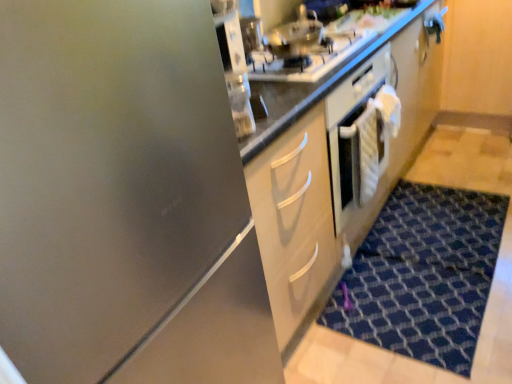
Question: Does stainless steel gas stove at upper center have a smaller size compared to stainless steel at upper center?

Choices:
 (A) yes
 (B) no

Answer: (B)

Question: From a real-world perspective, is stainless steel gas stove at upper center located beneath stainless steel at upper center?

Choices:
 (A) no
 (B) yes

Answer: (B)

Question: Is stainless steel gas stove at upper center directly adjacent to stainless steel at upper center?

Choices:
 (A) no
 (B) yes

Answer: (B)

Question: Does stainless steel gas stove at upper center have a greater width compared to stainless steel at upper center?

Choices:
 (A) no
 (B) yes

Answer: (B)

Question: Considering the relative positions of stainless steel gas stove at upper center and stainless steel at upper center in the image provided, is stainless steel gas stove at upper center to the left of stainless steel at upper center from the viewer's perspective?

Choices:
 (A) no
 (B) yes

Answer: (B)

Question: Considering the relative positions of stainless steel gas stove at upper center and stainless steel at upper center in the image provided, is stainless steel gas stove at upper center to the left or to the right of stainless steel at upper center?

Choices:
 (A) left
 (B) right

Answer: (A)

Question: Considering the positions of stainless steel gas stove at upper center and stainless steel at upper center in the image, is stainless steel gas stove at upper center taller or shorter than stainless steel at upper center?

Choices:
 (A) short
 (B) tall

Answer: (A)

Question: Does point (348, 54) appear closer or farther from the camera than point (309, 18)?

Choices:
 (A) closer
 (B) farther

Answer: (A)

Question: In terms of size, does stainless steel gas stove at upper center appear bigger or smaller than stainless steel at upper center?

Choices:
 (A) small
 (B) big

Answer: (B)

Question: In terms of height, does stainless steel at upper center look taller or shorter compared to stainless steel gas stove at upper center?

Choices:
 (A) short
 (B) tall

Answer: (B)

Question: From the image's perspective, is stainless steel at upper center above or below stainless steel gas stove at upper center?

Choices:
 (A) below
 (B) above

Answer: (B)

Question: Is stainless steel at upper center situated inside stainless steel gas stove at upper center or outside?

Choices:
 (A) inside
 (B) outside

Answer: (B)

Question: Does point (290, 51) appear closer or farther from the camera than point (349, 49)?

Choices:
 (A) closer
 (B) farther

Answer: (A)

Question: Visually, is stainless steel at upper center positioned to the left or to the right of blue textured rug at lower right?

Choices:
 (A) left
 (B) right

Answer: (A)

Question: From a real-world perspective, relative to blue textured rug at lower right, is stainless steel at upper center vertically above or below?

Choices:
 (A) below
 (B) above

Answer: (B)